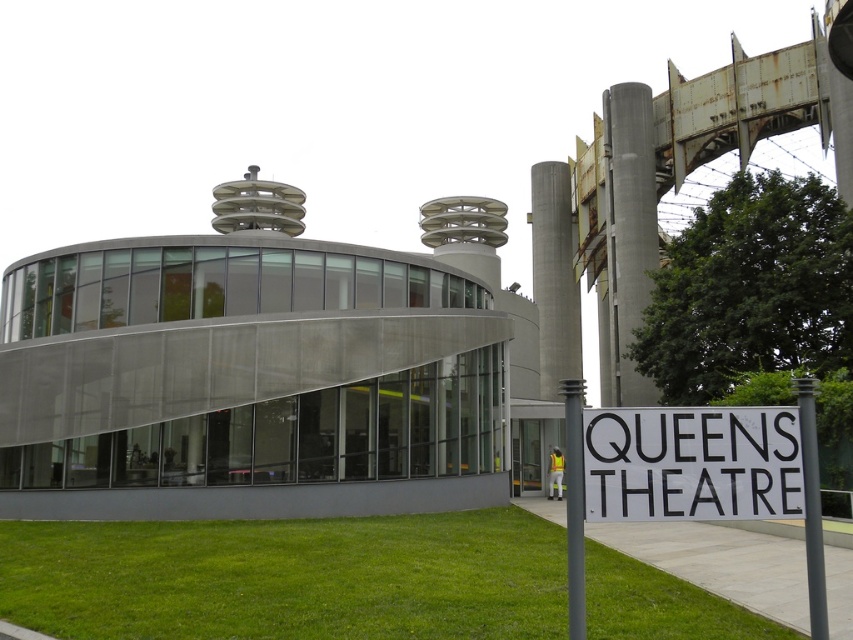
Question: Does white plastic sign at lower right lie in front of concrete at right?

Choices:
 (A) no
 (B) yes

Answer: (B)

Question: Which point appears farthest from the camera in this image?

Choices:
 (A) (599, 432)
 (B) (624, 122)

Answer: (B)

Question: Which point is farther to the camera?

Choices:
 (A) (572, 372)
 (B) (154, 612)
 (C) (755, 481)

Answer: (A)

Question: Is green grass at lower center to the left of concrete at right from the viewer's perspective?

Choices:
 (A) yes
 (B) no

Answer: (A)

Question: Estimate the real-world distances between objects in this image. Which object is farther from the concrete at center?

Choices:
 (A) concrete at right
 (B) green grass at lower center
 (C) white plastic sign at lower right

Answer: (C)

Question: Can you confirm if green grass at lower center is positioned to the left of white plastic sign at lower right?

Choices:
 (A) yes
 (B) no

Answer: (A)